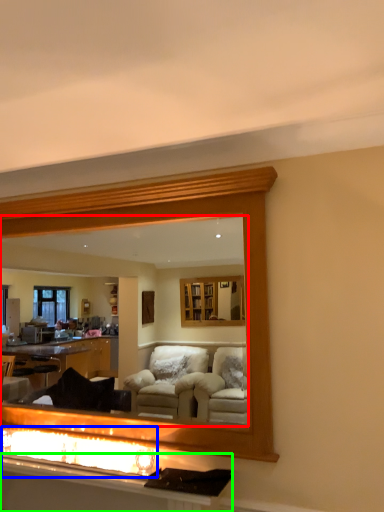
Question: Which object is positioned farthest from mirror (highlighted by a red box)? Select from reflection (highlighted by a blue box) and vanity (highlighted by a green box).

Choices:
 (A) reflection
 (B) vanity

Answer: (B)